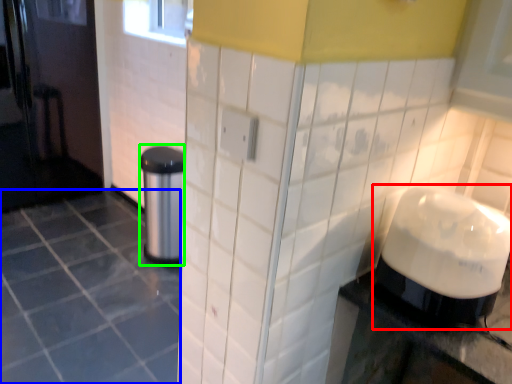
Question: Considering the real-world distances, which object is farthest from blender (highlighted by a red box)? ceramic tile (highlighted by a blue box) or appliance (highlighted by a green box)?

Choices:
 (A) ceramic tile
 (B) appliance

Answer: (B)